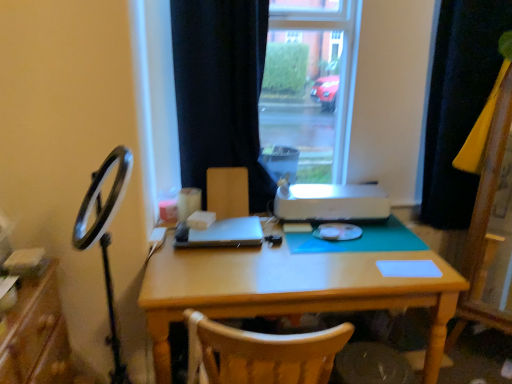
Locate an element on the screen. This screenshot has width=512, height=384. free space above wooden desk at center (from a real-world perspective) is located at coordinates (300, 251).